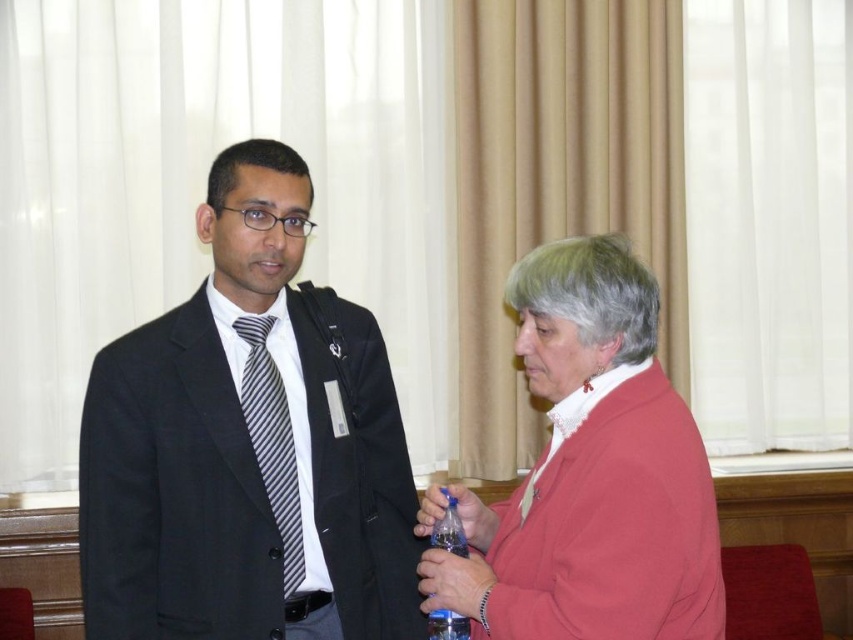
Question: Is matte black suit at left positioned at the back of striped fabric tie at left?

Choices:
 (A) yes
 (B) no

Answer: (B)

Question: Which object is farther from the camera taking this photo?

Choices:
 (A) striped fabric tie at left
 (B) matte black suit at left
 (C) matte red jacket at right

Answer: (A)

Question: Does matte red jacket at right appear over striped fabric tie at left?

Choices:
 (A) no
 (B) yes

Answer: (B)

Question: Which point is farther to the camera?

Choices:
 (A) striped fabric tie at left
 (B) matte black suit at left

Answer: (A)

Question: Among these objects, which one is nearest to the camera?

Choices:
 (A) matte black suit at left
 (B) striped fabric tie at left
 (C) matte red jacket at right

Answer: (C)

Question: Can you confirm if matte red jacket at right is smaller than striped fabric tie at left?

Choices:
 (A) yes
 (B) no

Answer: (B)